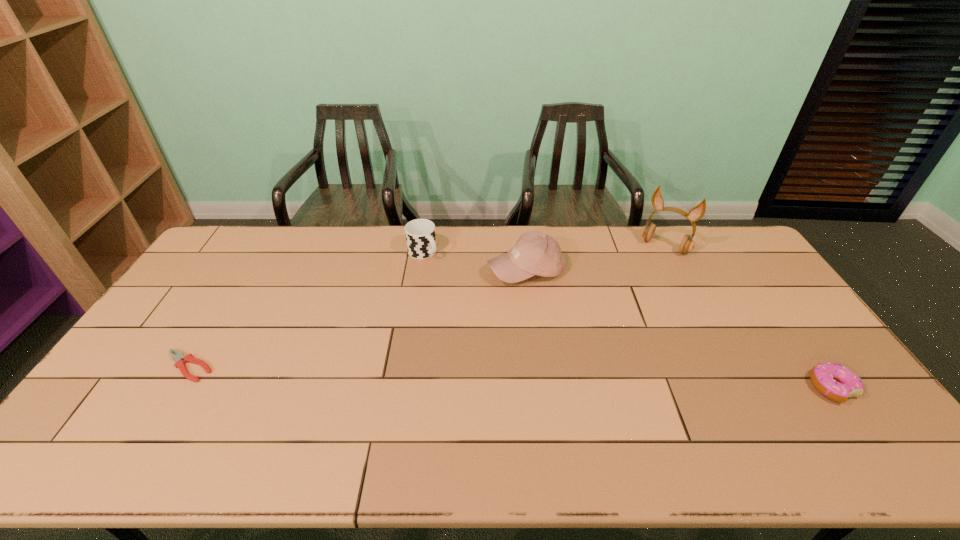
Where is `vacant spot on the desktop that is between the shortest object and the fourth tallest object and is positioned on the side of the cup with the handle`? Image resolution: width=960 pixels, height=540 pixels. vacant spot on the desktop that is between the shortest object and the fourth tallest object and is positioned on the side of the cup with the handle is located at coordinates (565, 379).

Where is `vacant spot on the desktop that is between the shortest object and the doughnut and is positioned on the front-facing side of the baseball cap`? The height and width of the screenshot is (540, 960). vacant spot on the desktop that is between the shortest object and the doughnut and is positioned on the front-facing side of the baseball cap is located at coordinates (x=503, y=377).

At what (x,y) coordinates should I click in order to perform the action: click on vacant spot on the desktop that is between the shortest object and the rightmost object and is positioned on the front-facing side of the tallest object. Please return your answer as a coordinate pair (x, y). This screenshot has height=540, width=960. Looking at the image, I should click on (581, 380).